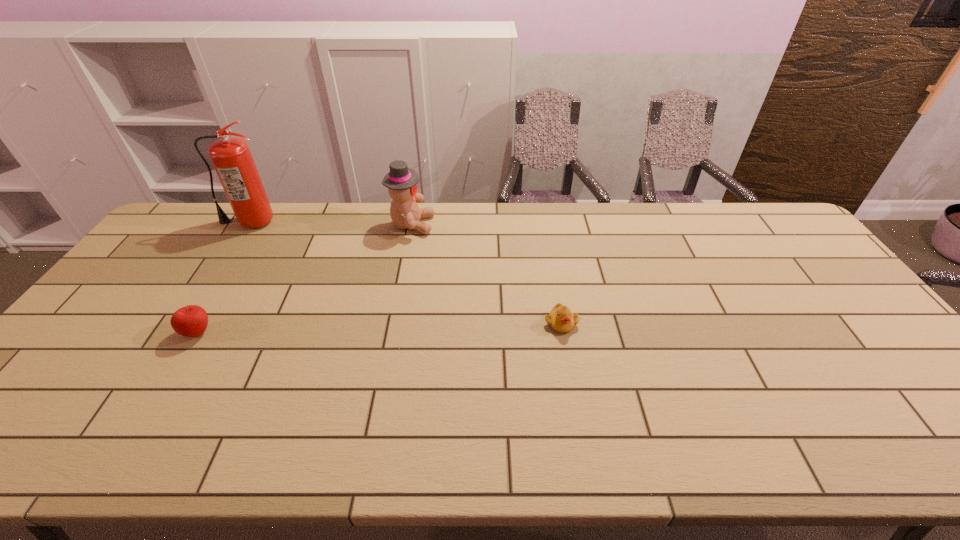
Locate an element on the screen. fire extinguisher is located at coordinates (231, 157).

This screenshot has height=540, width=960. I want to click on rag_doll, so click(401, 181).

Identify the location of the third object from left to right. Image resolution: width=960 pixels, height=540 pixels. (401, 181).

Image resolution: width=960 pixels, height=540 pixels. I want to click on apple, so click(190, 321).

You are a GUI agent. You are given a task and a screenshot of the screen. Output one action in this format:
    pyautogui.click(x=<x>, y=<y>)
    Task: Click on the duckling
    
    Given the screenshot: What is the action you would take?
    pyautogui.click(x=561, y=319)

Locate an element on the screen. the shortest object is located at coordinates (561, 319).

The width and height of the screenshot is (960, 540). Identify the location of free space located on the instruction side of the tallest object. (195, 306).

Locate an element on the screen. The image size is (960, 540). vacant space situated on the front-facing side of the third object from left to right is located at coordinates (460, 225).

You are a GUI agent. You are given a task and a screenshot of the screen. Output one action in this format:
    pyautogui.click(x=<x>, y=<y>)
    Task: Click on the vacant space located on the back of the apple
    Image resolution: width=960 pixels, height=540 pixels.
    Given the screenshot: What is the action you would take?
    pyautogui.click(x=254, y=240)

The image size is (960, 540). Find the location of `vacant space located 0.200m at the beak of the rightmost object`. vacant space located 0.200m at the beak of the rightmost object is located at coordinates (575, 402).